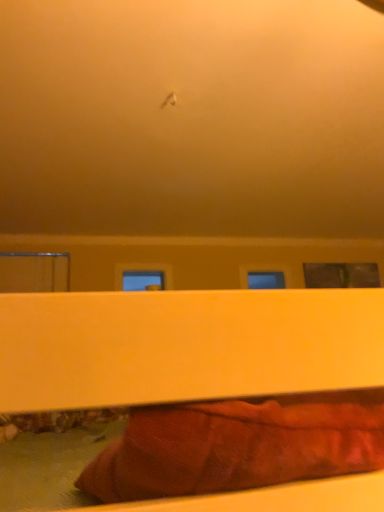
Find the location of `corduroy brown pillow at lower center`. corduroy brown pillow at lower center is located at coordinates (234, 448).

What do you see at coordinates (234, 448) in the screenshot? I see `corduroy brown pillow at lower center` at bounding box center [234, 448].

What are the coordinates of `corduroy brown pillow at lower center` in the screenshot? It's located at (234, 448).